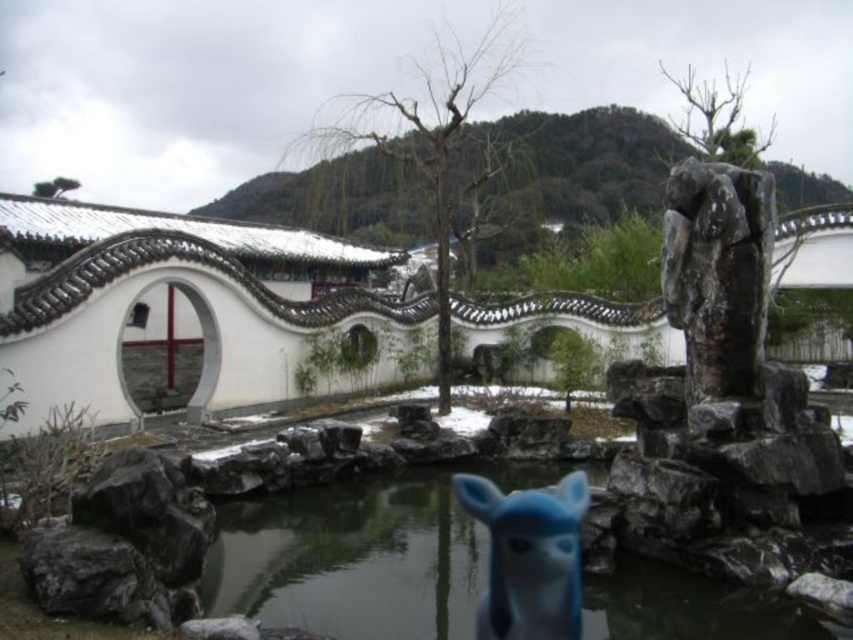
Question: Does clear water at center have a larger size compared to blue rubber animal at center?

Choices:
 (A) yes
 (B) no

Answer: (A)

Question: Which object is farther from the camera taking this photo?

Choices:
 (A) blue rubber animal at center
 (B) rough stone statue at right
 (C) clear water at center

Answer: (B)

Question: Is clear water at center above blue rubber animal at center?

Choices:
 (A) yes
 (B) no

Answer: (B)

Question: Which of the following is the farthest from the observer?

Choices:
 (A) (550, 493)
 (B) (756, 321)

Answer: (A)

Question: Is clear water at center positioned before blue rubber animal at center?

Choices:
 (A) no
 (B) yes

Answer: (B)

Question: Which point is closer to the camera?

Choices:
 (A) (314, 577)
 (B) (543, 579)

Answer: (B)